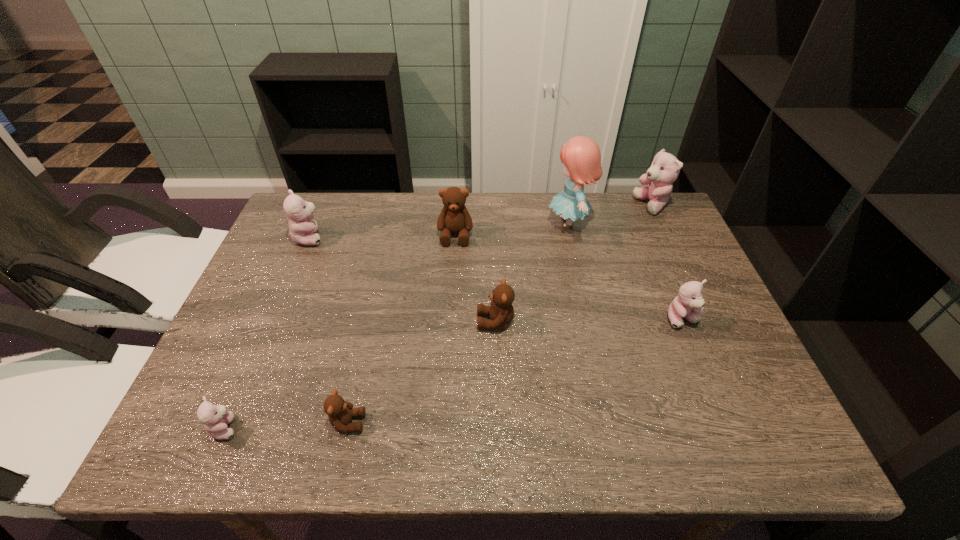
The width and height of the screenshot is (960, 540). I want to click on free space located on the face of the fourth teddy bear from left to right, so click(447, 363).

At what (x,y) coordinates should I click in order to perform the action: click on free space located on the face of the rightmost brown teddy bear. Please return your answer as a coordinate pair (x, y). The height and width of the screenshot is (540, 960). Looking at the image, I should click on (353, 322).

This screenshot has width=960, height=540. What are the coordinates of `free space located 0.250m on the face of the rightmost brown teddy bear` in the screenshot? It's located at (374, 322).

Locate an element on the screen. vacant region located on the face of the rightmost brown teddy bear is located at coordinates (366, 322).

Locate an element on the screen. The image size is (960, 540). free space located at the face of the third biggest pink teddy bear is located at coordinates (739, 456).

Locate an element on the screen. free space located 0.340m on the face of the third teddy bear from left to right is located at coordinates (534, 423).

Where is `free space located at the face of the nearest pink teddy bear`? Image resolution: width=960 pixels, height=540 pixels. free space located at the face of the nearest pink teddy bear is located at coordinates (415, 428).

Where is `doll that is positioned at the far edge`? This screenshot has height=540, width=960. doll that is positioned at the far edge is located at coordinates (581, 156).

Locate an element on the screen. This screenshot has width=960, height=540. object that is at the far left corner is located at coordinates (299, 212).

You are a GUI agent. You are given a task and a screenshot of the screen. Output one action in this format:
    pyautogui.click(x=<x>, y=<y>)
    Task: Click on the object located at the near left corner
    
    Given the screenshot: What is the action you would take?
    pyautogui.click(x=215, y=418)